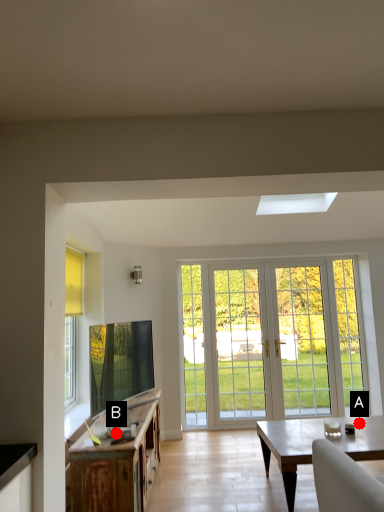
Question: Two points are circled on the image, labeled by A and B beside each circle. Among these points, which one is farthest from the camera?

Choices:
 (A) A is further
 (B) B is further

Answer: (A)